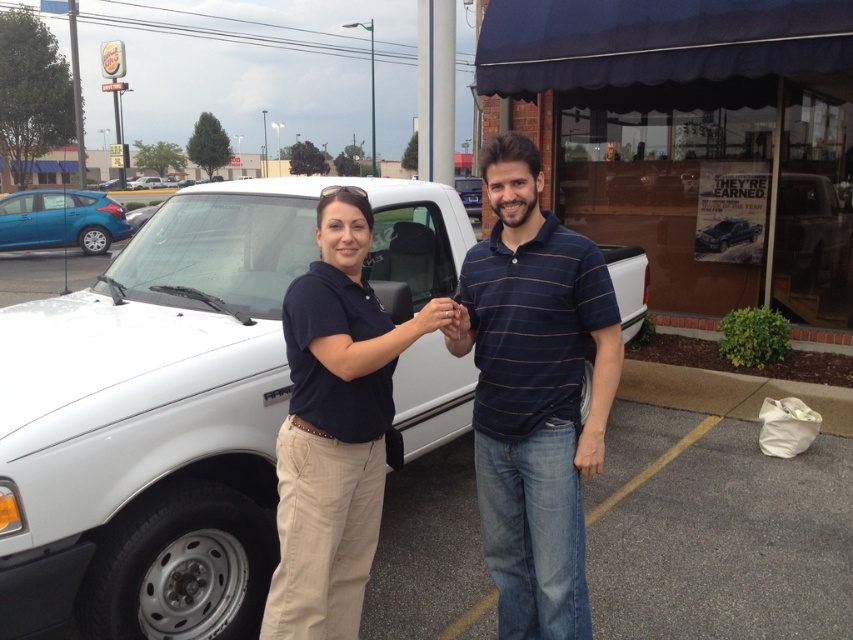
Question: Is matte blue truck at center below metallic silver truck at center?

Choices:
 (A) no
 (B) yes

Answer: (B)

Question: Which object appears farthest from the camera in this image?

Choices:
 (A) metallic silver truck at center
 (B) white matte truck at center

Answer: (A)

Question: Can you confirm if blue striped polo shirt at center is positioned above metallic blue hatchback at left?

Choices:
 (A) no
 (B) yes

Answer: (A)

Question: Estimate the real-world distances between objects in this image. Which object is farther from the metallic silver truck at center?

Choices:
 (A) metallic blue hatchback at left
 (B) matte blue truck at center
 (C) white matte truck at center

Answer: (A)

Question: Among these points, which one is farthest from the camera?

Choices:
 (A) coord(469,360)
 (B) coord(757,236)
 (C) coord(567,392)

Answer: (B)

Question: Can you confirm if metallic blue hatchback at left is smaller than metallic silver truck at center?

Choices:
 (A) no
 (B) yes

Answer: (B)